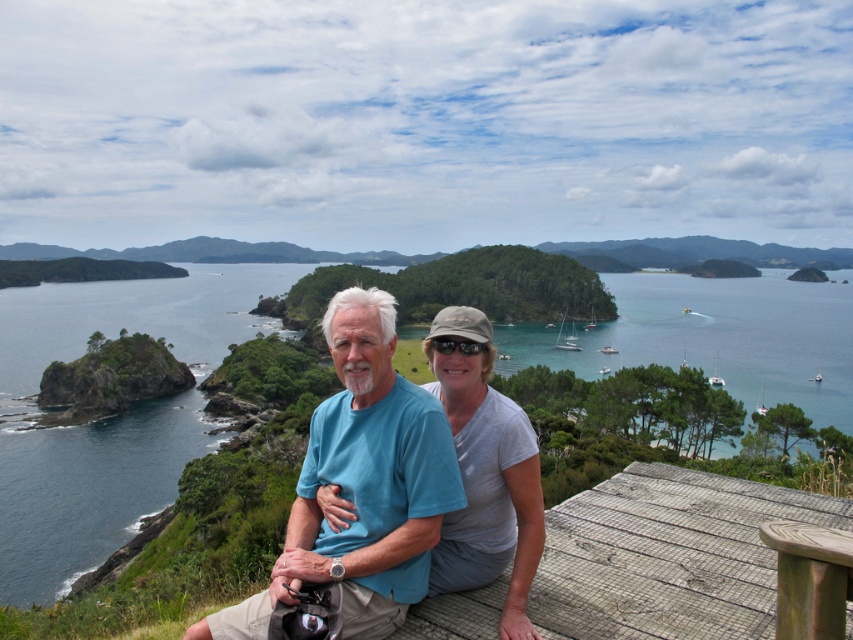
Is gray cotton shirt at center taller than wooden picnic table at lower right?

Indeed, gray cotton shirt at center has a greater height compared to wooden picnic table at lower right.

Is gray cotton shirt at center positioned in front of wooden picnic table at lower right?

No, it is not.

Which is behind, point (497, 492) or point (784, 547)?

The point (497, 492) is more distant.

This screenshot has height=640, width=853. Identify the location of gray cotton shirt at center. (485, 472).

Which is below, blue cotton t-shirt at center or wooden picnic table at lower right?

Positioned lower is blue cotton t-shirt at center.

Does point (311, 547) come closer to viewer compared to point (792, 545)?

No, it is not.

Does point (260, 620) come in front of point (805, 604)?

No, it is behind (805, 604).

Where is `blue cotton t-shirt at center`? blue cotton t-shirt at center is located at coordinates (363, 484).

Find the location of a particular element. The image size is (853, 640). blue cotton t-shirt at center is located at coordinates (363, 484).